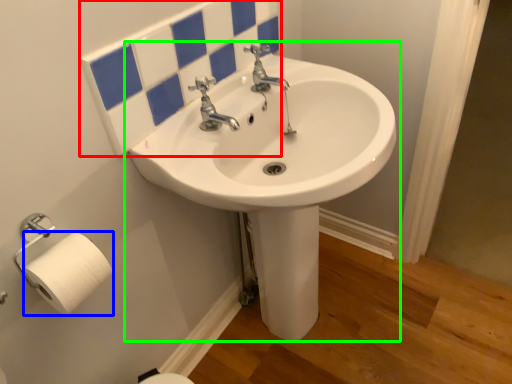
Question: Considering the real-world distances, which object is farthest from mirror (highlighted by a red box)? toilet paper (highlighted by a blue box) or sink (highlighted by a green box)?

Choices:
 (A) toilet paper
 (B) sink

Answer: (A)